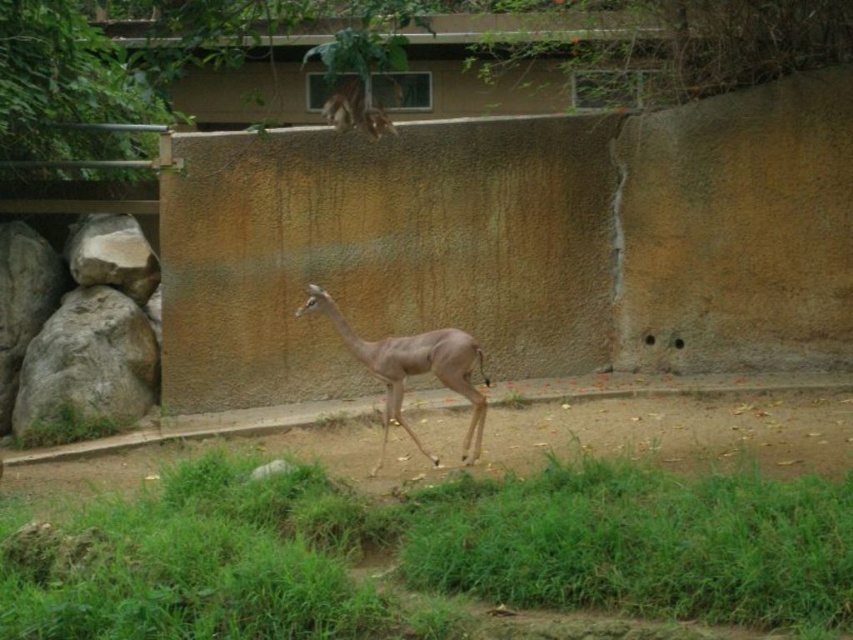
Question: Is green grass at lower center smaller than light brown fur at center?

Choices:
 (A) no
 (B) yes

Answer: (A)

Question: Among these objects, which one is nearest to the camera?

Choices:
 (A) light brown fur at center
 (B) green grass at lower center

Answer: (B)

Question: Does green grass at lower center have a lesser width compared to light brown fur at center?

Choices:
 (A) no
 (B) yes

Answer: (A)

Question: Among these objects, which one is nearest to the camera?

Choices:
 (A) green grass at lower center
 (B) light brown fur at center

Answer: (A)

Question: Is green grass at lower center below light brown fur at center?

Choices:
 (A) no
 (B) yes

Answer: (B)

Question: Which object is farther from the camera taking this photo?

Choices:
 (A) green grass at lower center
 (B) light brown fur at center

Answer: (B)